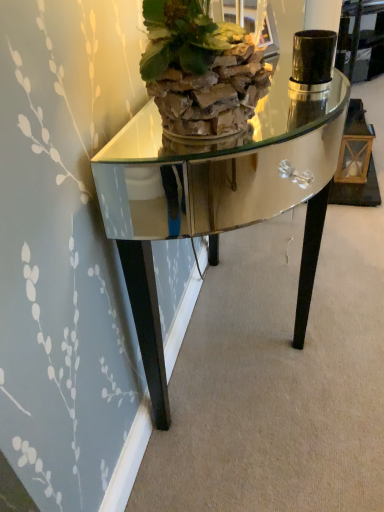
Question: Would you say green leafy plant at upper center is to the left or to the right of shiny mirrored table at center in the picture?

Choices:
 (A) left
 (B) right

Answer: (A)

Question: In terms of height, does green leafy plant at upper center look taller or shorter compared to shiny mirrored table at center?

Choices:
 (A) tall
 (B) short

Answer: (B)

Question: From the image's perspective, is green leafy plant at upper center positioned above or below shiny mirrored table at center?

Choices:
 (A) below
 (B) above

Answer: (B)

Question: Relative to green leafy plant at upper center, is shiny mirrored table at center in front or behind?

Choices:
 (A) front
 (B) behind

Answer: (B)

Question: From a real-world perspective, is shiny mirrored table at center physically located above or below green leafy plant at upper center?

Choices:
 (A) below
 (B) above

Answer: (A)

Question: Visually, is shiny mirrored table at center positioned to the left or to the right of green leafy plant at upper center?

Choices:
 (A) left
 (B) right

Answer: (B)

Question: Is shiny mirrored table at center wider or thinner than green leafy plant at upper center?

Choices:
 (A) wide
 (B) thin

Answer: (A)